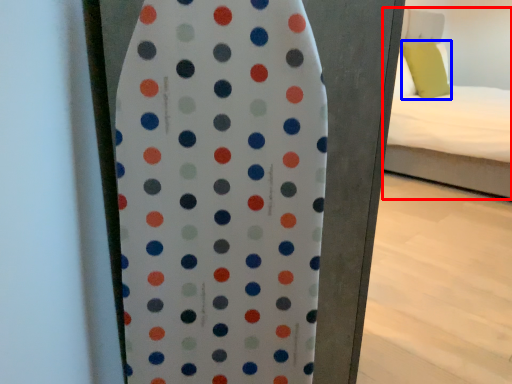
Question: Among these objects, which one is farthest to the camera, bed (highlighted by a red box) or pillow (highlighted by a blue box)?

Choices:
 (A) bed
 (B) pillow

Answer: (B)